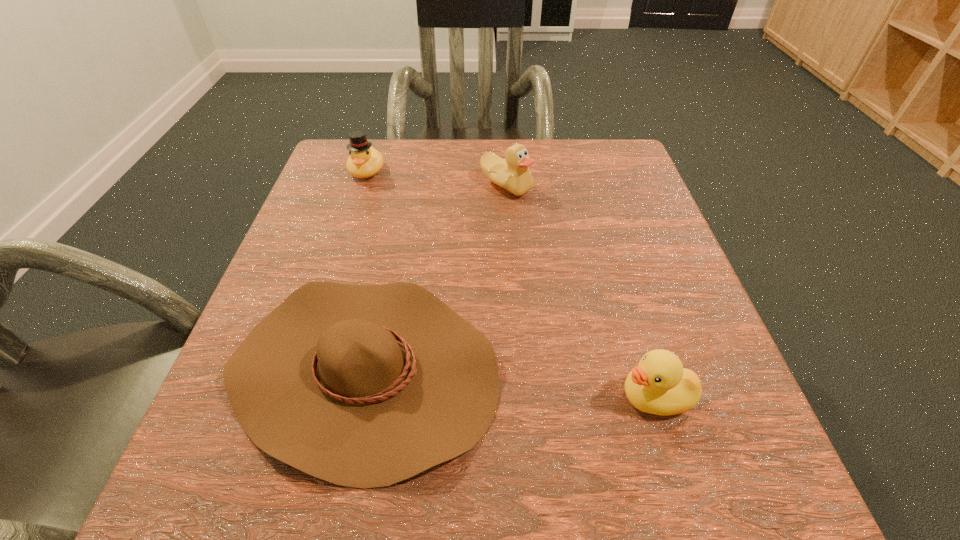
This screenshot has width=960, height=540. What are the coordinates of `vacant space located 0.190m on the right of the cowboy hat` in the screenshot? It's located at (630, 369).

Locate an element on the screen. object located at the near edge is located at coordinates (364, 386).

I want to click on duck that is at the left edge, so click(364, 161).

The image size is (960, 540). Find the location of `cowboy hat that is at the left edge`. cowboy hat that is at the left edge is located at coordinates pyautogui.click(x=364, y=386).

Identify the location of object at the right edge. This screenshot has width=960, height=540. (659, 385).

Locate an element on the screen. This screenshot has width=960, height=540. object at the far left corner is located at coordinates (364, 161).

The height and width of the screenshot is (540, 960). I want to click on object that is positioned at the near left corner, so click(364, 386).

This screenshot has height=540, width=960. Find the location of `vacant space at the far edge of the desktop`. vacant space at the far edge of the desktop is located at coordinates (550, 175).

Where is `blank area at the near edge`? blank area at the near edge is located at coordinates (316, 494).

Find the location of a particular element. vacant space at the right edge of the desktop is located at coordinates (699, 335).